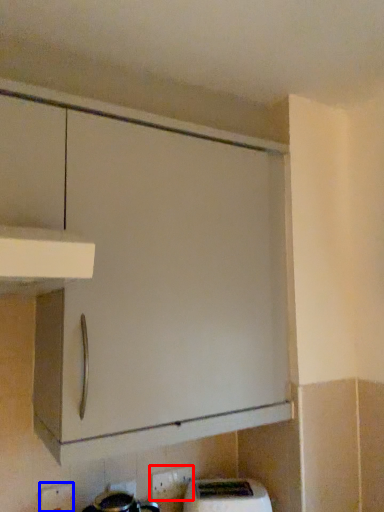
Question: Which point is closer to the camera, electric outlet (highlighted by a red box) or electric outlet (highlighted by a blue box)?

Choices:
 (A) electric outlet
 (B) electric outlet

Answer: (B)